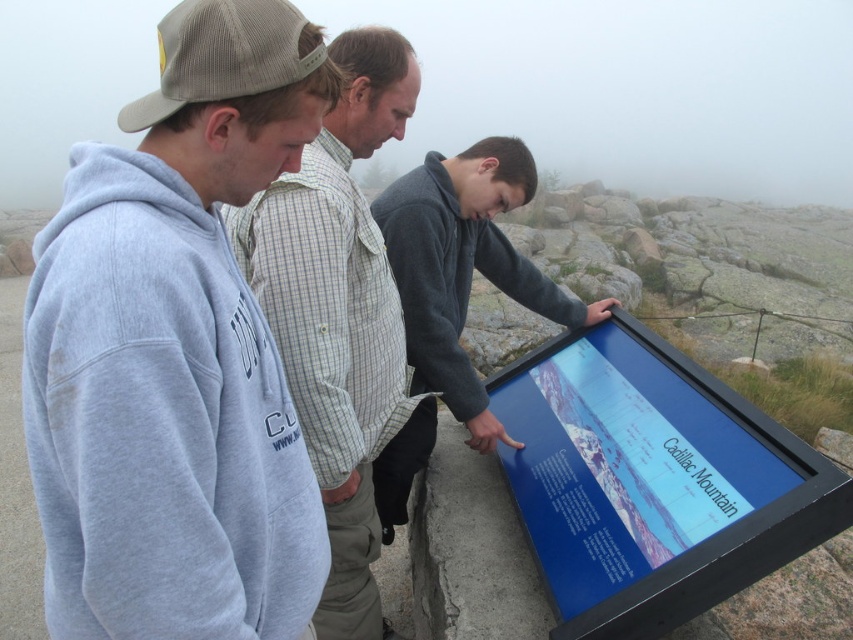
Does blue glossy tablet at center appear on the right side of light gray sweatshirt at center?

Correct, you'll find blue glossy tablet at center to the right of light gray sweatshirt at center.

Which of these two, blue glossy tablet at center or light gray sweatshirt at center, stands taller?

light gray sweatshirt at center

Which is behind, point (599, 467) or point (345, 392)?

Point (599, 467)

The image size is (853, 640). What are the coordinates of `blue glossy tablet at center` in the screenshot? It's located at (653, 481).

Which is more to the left, light gray hoodie at left or light gray sweatshirt at center?

A: light gray hoodie at left

Can you confirm if light gray hoodie at left is taller than light gray sweatshirt at center?

Incorrect, light gray hoodie at left's height is not larger of light gray sweatshirt at center's.

Between point (200, 595) and point (321, 436), which one is positioned in front?

Point (200, 595) is in front.

The width and height of the screenshot is (853, 640). I want to click on light gray hoodie at left, so click(x=177, y=353).

Who is more forward, [282,125] or [581,332]?

Positioned in front is point [282,125].

Who is positioned more to the right, light gray hoodie at left or blue glossy tablet at center?

blue glossy tablet at center

The height and width of the screenshot is (640, 853). What are the coordinates of `light gray hoodie at left` in the screenshot? It's located at (177, 353).